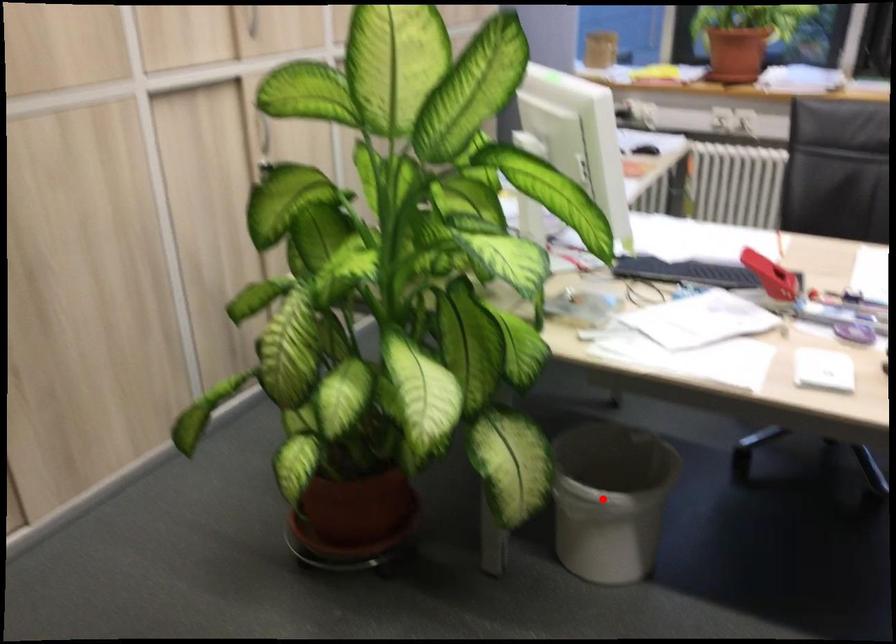
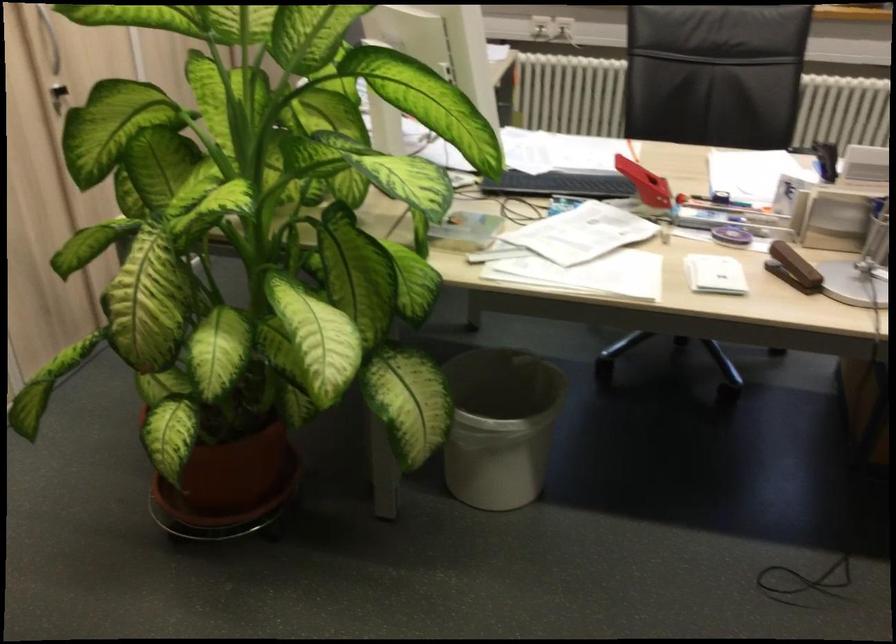
Find the pixel in the second image that matches the highlighted location in the first image.

(500, 426)